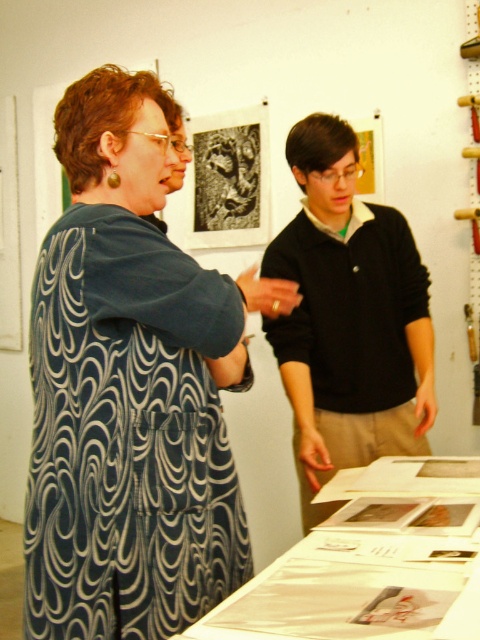
You are standing in the room and want to determine the relative positions of two points marked in the image. Which point is closer to you, point (x=197, y=433) or point (x=423, y=445)?

Point (x=197, y=433) is closer to the viewer than point (x=423, y=445).

You are organizing a clothing display and need to arrange the blue swirled fabric at center and the black sweater at center side by side. Based on their sizes, which one should be placed on the left to ensure they fit within the display area?

The blue swirled fabric at center has a smaller width than the black sweater at center, so placing the narrower blue swirled fabric at center on the left will allow both items to fit better within the display area.

You are standing in the room where the two people are talking. There are two points marked in the scene. One is at coordinates point (215, 369) and the other is at point (200, 148). Which point is closer to you?

Point (215, 369) is closer to the viewer than point (200, 148).